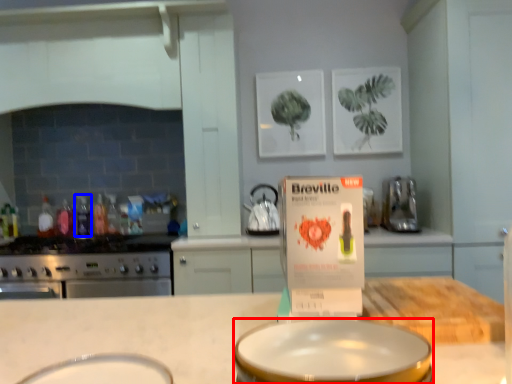
Question: Which point is further to the camera, basin (highlighted by a red box) or bottle (highlighted by a blue box)?

Choices:
 (A) basin
 (B) bottle

Answer: (B)